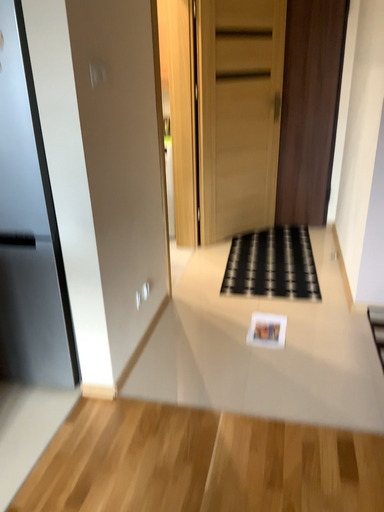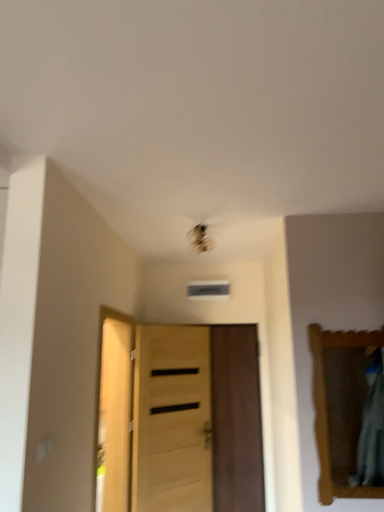
Question: Which way did the camera rotate in the video?

Choices:
 (A) rotated right
 (B) rotated left

Answer: (A)